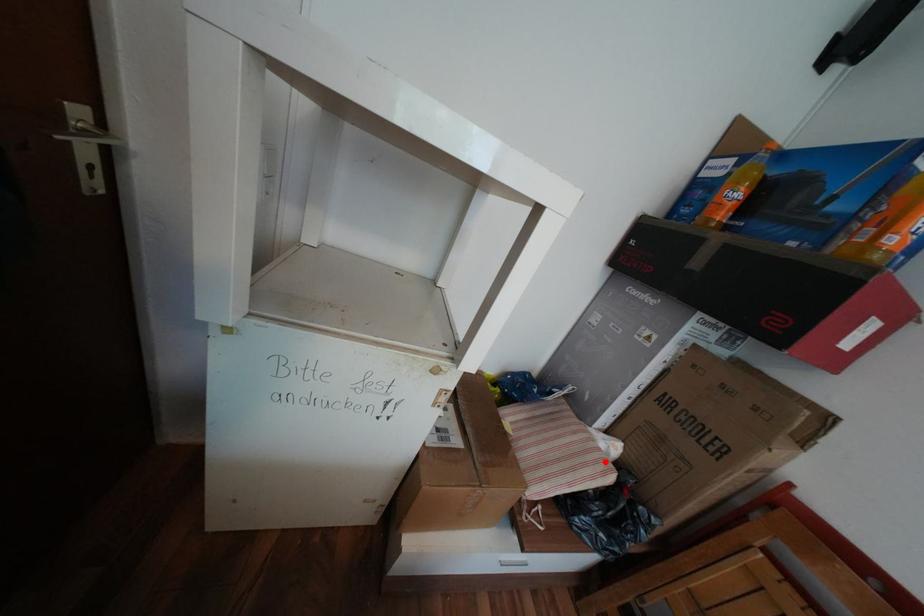
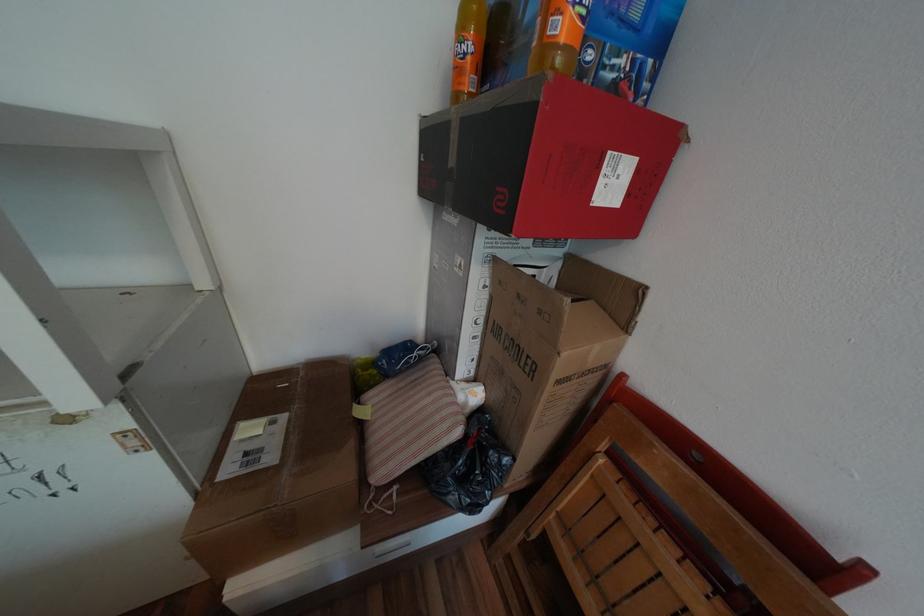
Where in the second image is the point corresponding to the highlighted location from the first image?

(453, 419)